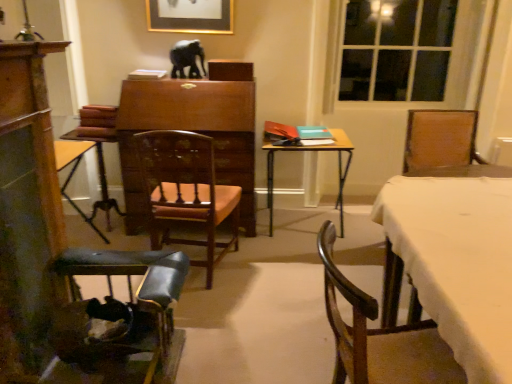
Question: Visually, is wooden dresser at left positioned to the left or to the right of wooden polished chair at center, the 2th chair from the left?

Choices:
 (A) right
 (B) left

Answer: (B)

Question: Does point (25, 291) appear closer or farther from the camera than point (207, 238)?

Choices:
 (A) closer
 (B) farther

Answer: (A)

Question: Estimate the real-world distances between objects in this image. Which object is farther from the wooden dresser at left?

Choices:
 (A) wooden polished chair at center, which is the 2th chair from right to left
 (B) wooden chair at lower right, the third chair positioned from the left
 (C) matte gold picture frame at upper center
 (D) wooden armchair at center
 (E) wooden table at center

Answer: (E)

Question: Considering the real-world distances, which object is farthest from the white cloth-covered table at right?

Choices:
 (A) wooden table at center
 (B) shiny black elephant at center
 (C) wooden armchair at center
 (D) wooden polished chair at center, the 2th chair from the left
 (E) wooden dresser at left

Answer: (C)